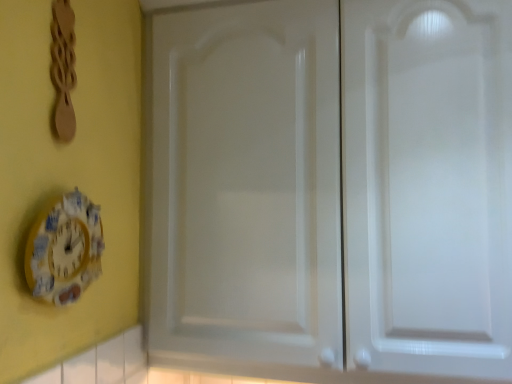
Question: In terms of width, does wooden spoon at upper left look wider or thinner when compared to white glossy cabinet doors at center?

Choices:
 (A) wide
 (B) thin

Answer: (B)

Question: Would you say wooden spoon at upper left is to the left or to the right of white glossy cabinet doors at center in the picture?

Choices:
 (A) right
 (B) left

Answer: (B)

Question: Which object is positioned farthest from the white glossy cabinet doors at center?

Choices:
 (A) wooden spoon at upper left
 (B) yellow painted wood clock at lower left

Answer: (A)

Question: Estimate the real-world distances between objects in this image. Which object is closer to the yellow painted wood clock at lower left?

Choices:
 (A) white glossy cabinet doors at center
 (B) wooden spoon at upper left

Answer: (B)